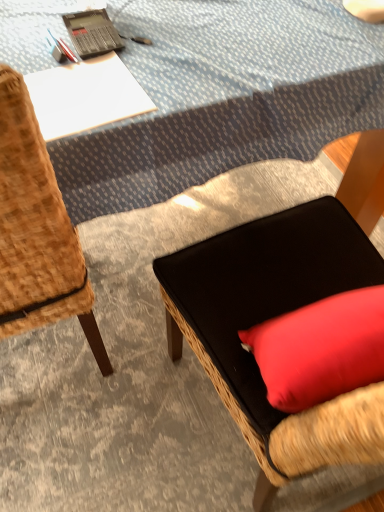
You are a GUI agent. You are given a task and a screenshot of the screen. Output one action in this format:
    pyautogui.click(x=<x>, y=<y>)
    Task: Click on the free space in front of black plastic calculator at upper left
    The image size is (384, 512).
    Given the screenshot: What is the action you would take?
    pyautogui.click(x=92, y=84)